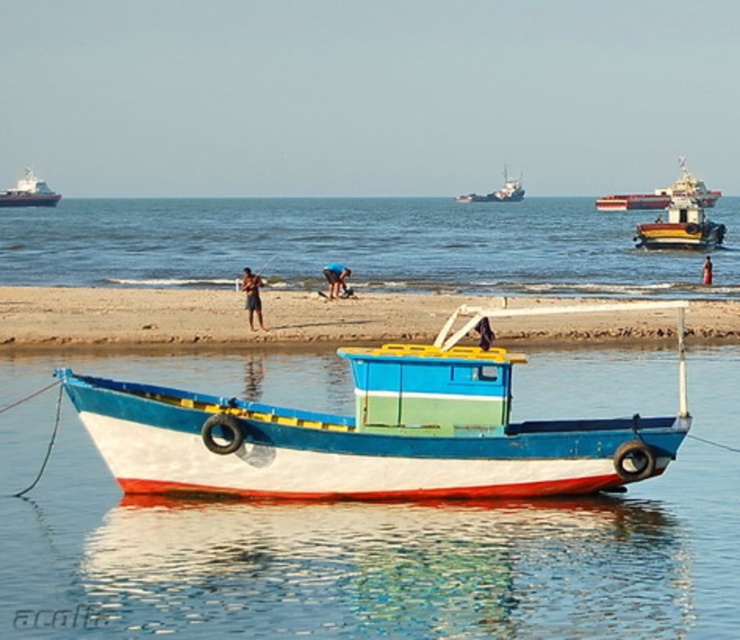
You are standing on the beach looking at the fishing boat. There are two points marked on the boat. One is at coordinate point (279, 280) and the other is at point (682, 172). Which point is closer to you?

Point (279, 280) is closer to the viewer than point (682, 172).